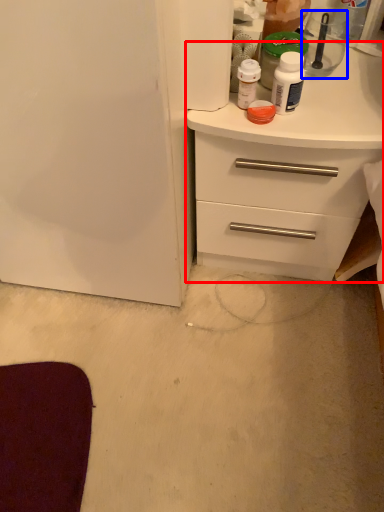
Question: Which object appears closest to the camera in this image, chest of drawers (highlighted by a red box) or appliance (highlighted by a blue box)?

Choices:
 (A) chest of drawers
 (B) appliance

Answer: (A)